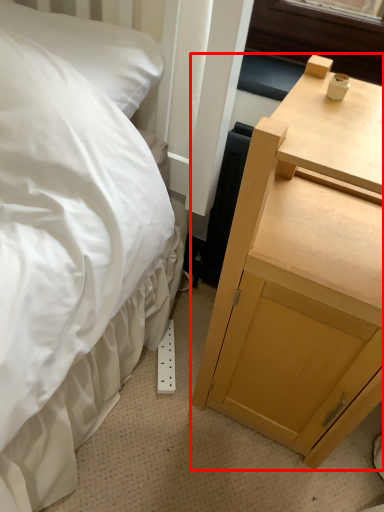
Question: In this image, where is nightstand (annotated by the red box) located relative to pillow?

Choices:
 (A) right
 (B) left

Answer: (A)